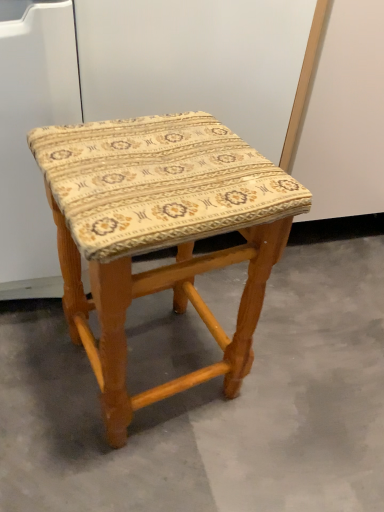
Image resolution: width=384 pixels, height=512 pixels. I want to click on vacant area that lies in front of wooden stool at center, so click(x=139, y=469).